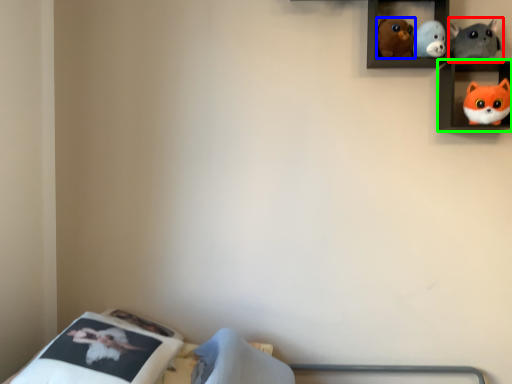
Question: Which object is positioned farthest from toy (highlighted by a red box)? Select from toy (highlighted by a blue box) and shelf (highlighted by a green box).

Choices:
 (A) toy
 (B) shelf

Answer: (A)